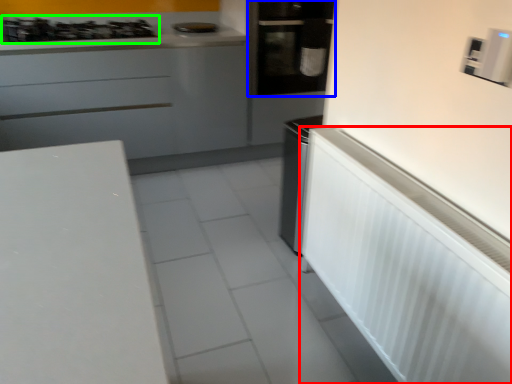
Question: Considering the real-world distances, which object is closest to appliance (highlighted by a red box)? home appliance (highlighted by a blue box) or gas stove (highlighted by a green box).

Choices:
 (A) home appliance
 (B) gas stove

Answer: (A)